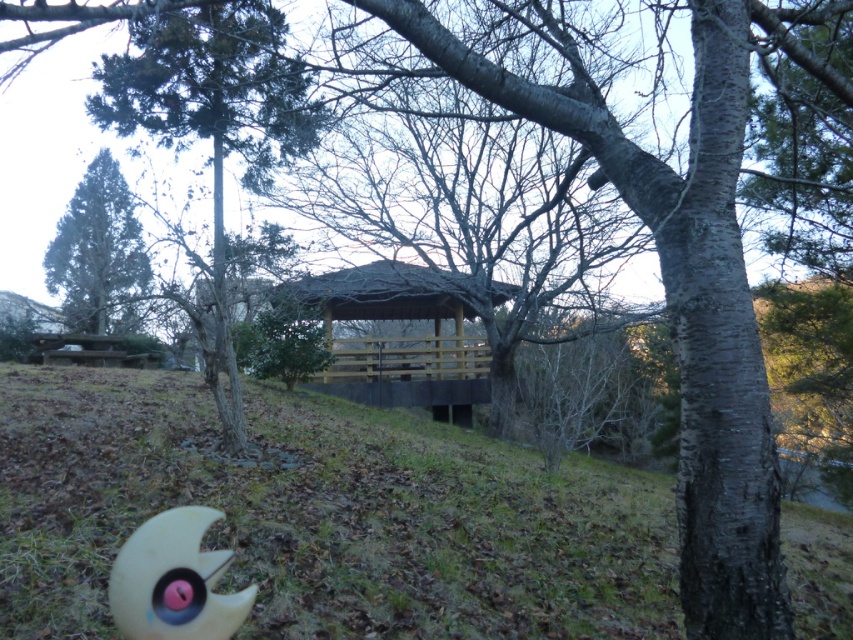
Question: Which point is closer to the camera?

Choices:
 (A) green matte tree at upper left
 (B) pink rubber crescent moon at lower left
 (C) wooden gazebo at center
 (D) brown dry grass at lower center

Answer: (B)

Question: Is wooden gazebo at center to the right of pink rubber crescent moon at lower left from the viewer's perspective?

Choices:
 (A) yes
 (B) no

Answer: (A)

Question: From the image, what is the correct spatial relationship of brown dry grass at lower center in relation to green matte tree at upper left?

Choices:
 (A) left
 (B) right

Answer: (B)

Question: Observing the image, what is the correct spatial positioning of wooden gazebo at center in reference to pink rubber crescent moon at lower left?

Choices:
 (A) above
 (B) below

Answer: (A)

Question: Which object is the farthest from the green matte tree at upper left?

Choices:
 (A) pink rubber crescent moon at lower left
 (B) wooden gazebo at center

Answer: (A)

Question: Which point is farther to the camera?

Choices:
 (A) (347, 404)
 (B) (328, 291)
 (C) (85, 218)

Answer: (C)